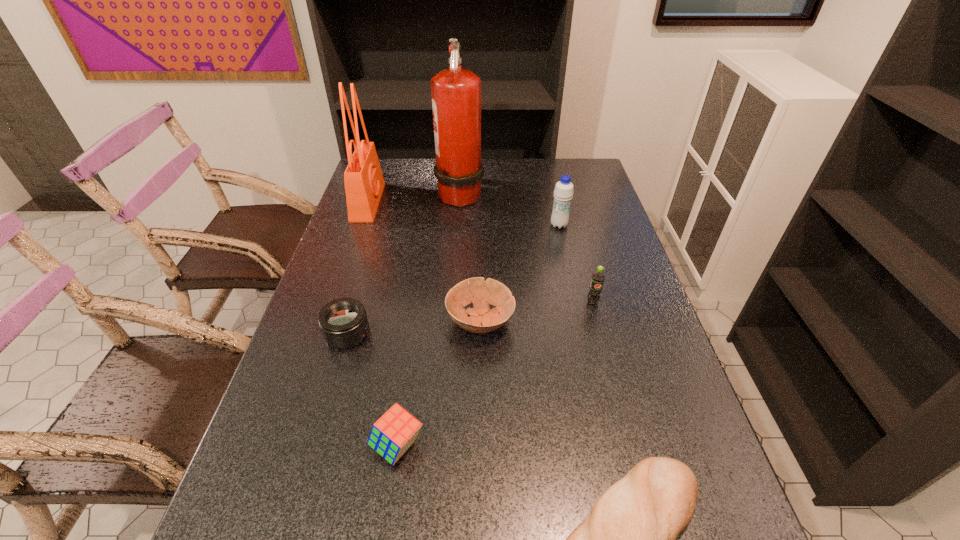
Where is `vacant point located on the front label of the soda`? Image resolution: width=960 pixels, height=540 pixels. vacant point located on the front label of the soda is located at coordinates click(x=633, y=451).

Locate an element on the screen. The width and height of the screenshot is (960, 540). vacant region located 0.250m on the right of the cube is located at coordinates (549, 446).

You are a GUI agent. You are given a task and a screenshot of the screen. Output one action in this format:
    pyautogui.click(x=<x>, y=<y>)
    Task: Click on the free space located 0.210m on the left of the bowl
    
    Given the screenshot: What is the action you would take?
    pyautogui.click(x=365, y=321)

At what (x,y) coordinates should I click in order to perform the action: click on vacant space positioned on the side of the telephoto lens with brand markings and control switches. Please return your answer as a coordinate pair (x, y). The image size is (960, 540). Looking at the image, I should click on (399, 334).

Image resolution: width=960 pixels, height=540 pixels. Identify the location of fire extinguisher at the far edge. (456, 93).

The image size is (960, 540). In order to click on tote bag that is at the far edge in this screenshot , I will do `click(364, 183)`.

Find the location of a particular element. tote bag located in the left edge section of the desktop is located at coordinates (364, 183).

Where is `telephoto lens located in the left edge section of the desktop`? The height and width of the screenshot is (540, 960). telephoto lens located in the left edge section of the desktop is located at coordinates (343, 322).

In order to click on water bottle located at the right edge in this screenshot , I will do `click(563, 193)`.

The height and width of the screenshot is (540, 960). Identify the location of soda present at the right edge. (598, 277).